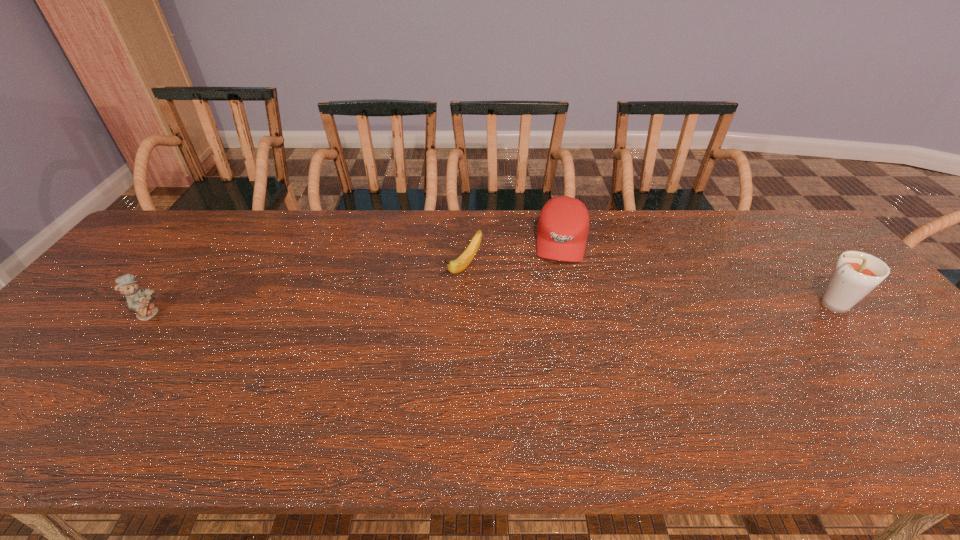
Identify the location of the leftmost object. Image resolution: width=960 pixels, height=540 pixels. (138, 299).

Locate an element on the screen. the tallest object is located at coordinates (856, 274).

Locate an element on the screen. root beer is located at coordinates (856, 274).

Find the location of a particular element. cap is located at coordinates (563, 225).

This screenshot has height=540, width=960. Find the location of `the shortest object`. the shortest object is located at coordinates (462, 262).

The width and height of the screenshot is (960, 540). In order to click on banana in this screenshot , I will do `click(462, 262)`.

Find the location of a particular element. vacant point located 0.320m on the front-facing side of the leftmost object is located at coordinates (281, 313).

Find the location of `free point located on the drink side of the root beer`. free point located on the drink side of the root beer is located at coordinates (780, 305).

The width and height of the screenshot is (960, 540). Identify the location of vacant point located 0.140m on the drink side of the root beer. (751, 305).

Identify the location of vacant space located 0.110m on the drink side of the root beer. (762, 305).